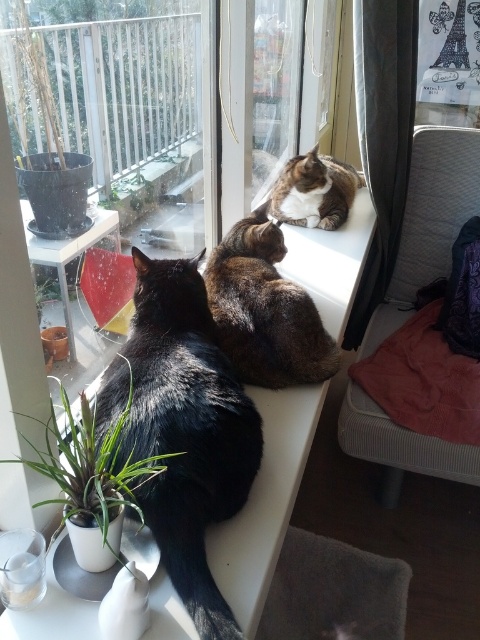
Does point (249, 234) lie in front of point (78, 436)?

No, (249, 234) is behind (78, 436).

Who is positioned more to the left, brown fur cat at center or green leafy plant at lower left?

green leafy plant at lower left is more to the left.

Does point (300, 339) come in front of point (115, 499)?

No, (300, 339) is behind (115, 499).

Locate an element on the screen. This screenshot has height=640, width=480. brown fur cat at center is located at coordinates (264, 308).

Between brown fur cat at center and tabby fur cat at upper center, which one has more height?

brown fur cat at center is taller.

Who is positioned more to the right, brown fur cat at center or tabby fur cat at upper center?

Positioned to the right is tabby fur cat at upper center.

You are a GUI agent. You are given a task and a screenshot of the screen. Output one action in this format:
    pyautogui.click(x=<x>, y=<y>)
    Task: Click on the brown fur cat at center
    This screenshot has height=640, width=480.
    Given the screenshot: What is the action you would take?
    pyautogui.click(x=264, y=308)

In order to click on brown fur cat at center in this screenshot , I will do `click(264, 308)`.

Is green leafy plant at lower left taller than tabby fur cat at upper center?

In fact, green leafy plant at lower left may be shorter than tabby fur cat at upper center.

Does green leafy plant at lower left appear on the left side of tabby fur cat at upper center?

Yes, green leafy plant at lower left is to the left of tabby fur cat at upper center.

Is point (104, 524) less distant than point (316, 211)?

Yes, point (104, 524) is closer to viewer.

Identify the location of green leafy plant at lower left. Image resolution: width=480 pixels, height=640 pixels. (92, 468).